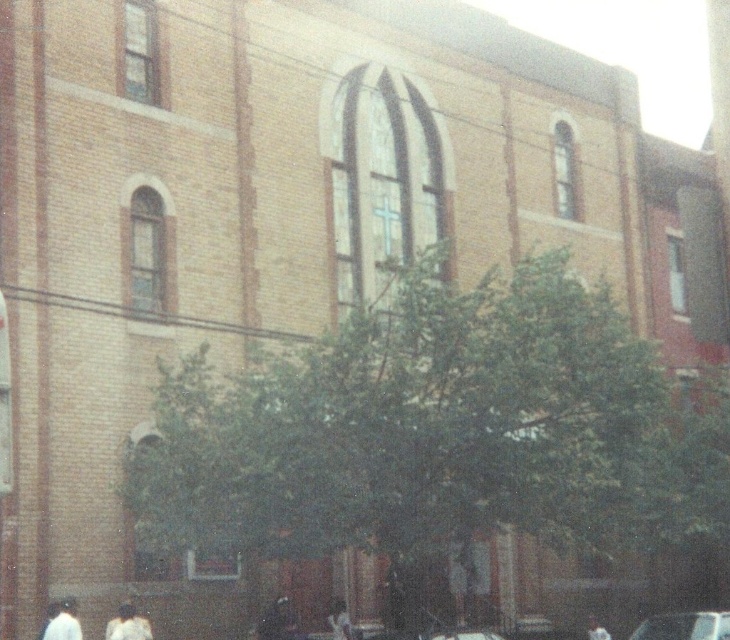
In the scene shown: Does shiny silver car at lower right have a larger size compared to metallic silver car at center?

Yes, shiny silver car at lower right is bigger than metallic silver car at center.

Which is more to the right, shiny silver car at lower right or metallic silver car at center?

Positioned to the right is shiny silver car at lower right.

Is point (712, 637) positioned behind point (434, 637)?

Yes.

Locate an element on the screen. This screenshot has height=640, width=730. shiny silver car at lower right is located at coordinates (683, 627).

What do you see at coordinates (339, 620) in the screenshot? This screenshot has height=640, width=730. I see `white matte person at lower center` at bounding box center [339, 620].

Which is below, white matte person at lower center or light brown hair at lower right?

light brown hair at lower right is lower down.

Is point (347, 621) positioned behind point (588, 620)?

That is False.

Where is `white matte person at lower center`? The height and width of the screenshot is (640, 730). white matte person at lower center is located at coordinates (339, 620).

In the scene shown: Can you confirm if white matte person at lower center is shorter than metallic silver car at center?

Correct, white matte person at lower center is not as tall as metallic silver car at center.

Does point (342, 632) come in front of point (487, 630)?

That is True.

The height and width of the screenshot is (640, 730). Identify the location of white matte person at lower center. (339, 620).